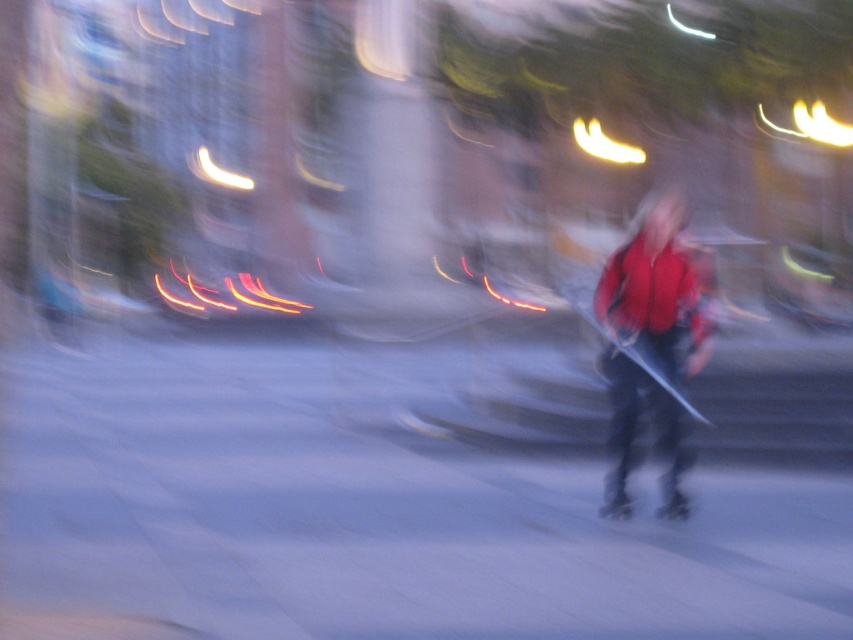
Question: Does gray asphalt at center have a greater width compared to shiny black roller skate at center?

Choices:
 (A) yes
 (B) no

Answer: (A)

Question: Does black rubber roller skate at lower right appear on the right side of shiny black roller skate at center?

Choices:
 (A) yes
 (B) no

Answer: (B)

Question: Is gray asphalt at center below metallic silver skateboard at center?

Choices:
 (A) no
 (B) yes

Answer: (B)

Question: Among these points, which one is farthest from the camera?

Choices:
 (A) (125, 561)
 (B) (676, 193)
 (C) (628, 515)
 (D) (648, 356)

Answer: (B)

Question: Considering the real-world distances, which object is closest to the gray asphalt at center?

Choices:
 (A) metallic silver skateboard at center
 (B) red matte jacket at center

Answer: (A)

Question: Which point appears farthest from the camera in this image?

Choices:
 (A) (675, 502)
 (B) (614, 500)
 (C) (680, 452)

Answer: (C)